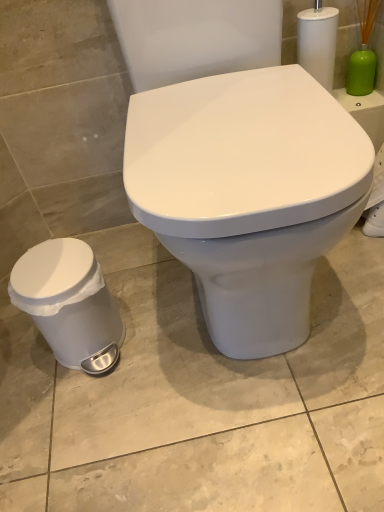
Find the location of a particular element. vacant space situated on the left part of white plastic trash can at lower left is located at coordinates (19, 359).